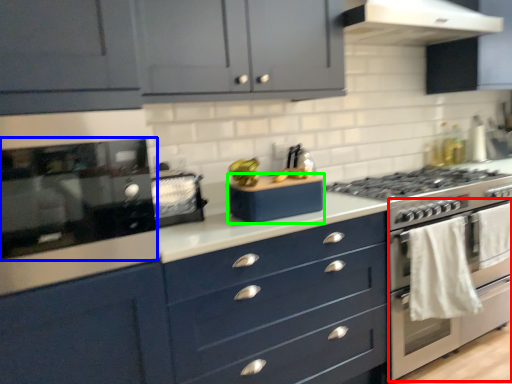
Question: Which object is positioned closest to oven (highlighted by a red box)? Select from kitchen appliance (highlighted by a blue box) and appliance (highlighted by a green box).

Choices:
 (A) kitchen appliance
 (B) appliance

Answer: (B)